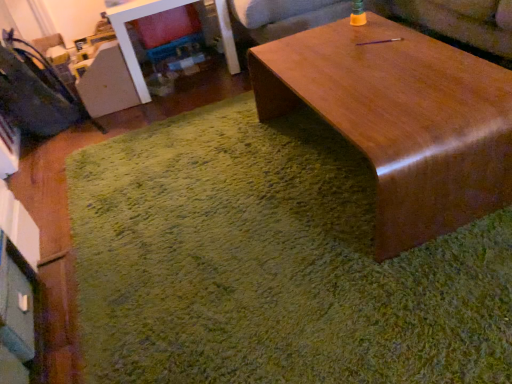
Identify the location of free space on the front side of glossy wood coffee table at center. (372, 292).